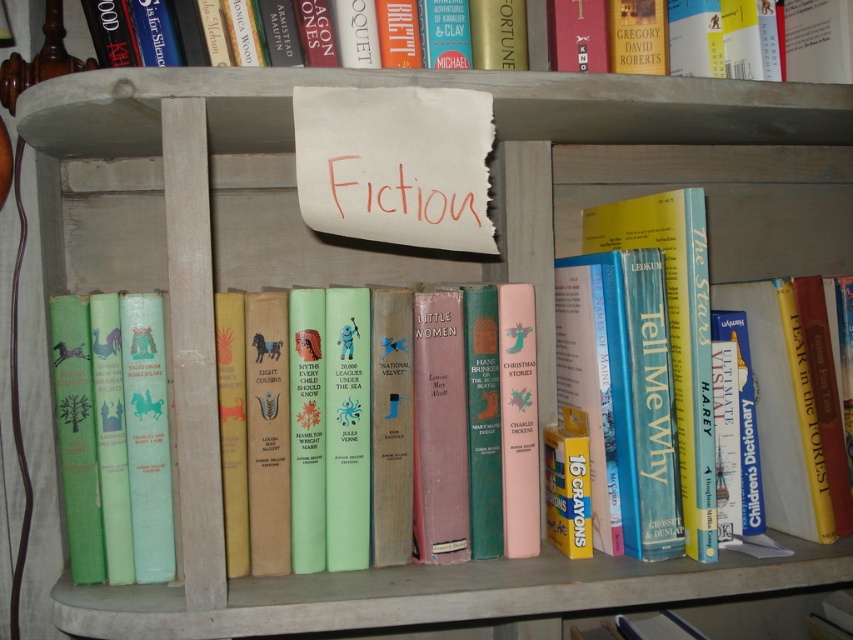
In the scene shown: Does blue hardcover book at center have a larger size compared to hardcover book at upper center?

Correct, blue hardcover book at center is larger in size than hardcover book at upper center.

Can you confirm if blue hardcover book at center is taller than hardcover book at upper center?

Yes, blue hardcover book at center is taller than hardcover book at upper center.

Which is in front, point (635, 243) or point (728, 28)?

Positioned in front is point (728, 28).

The image size is (853, 640). What are the coordinates of `blue hardcover book at center` in the screenshot? It's located at (676, 332).